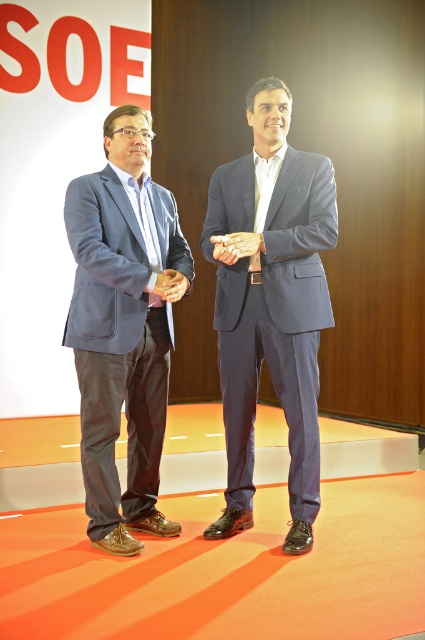
Question: Estimate the real-world distances between objects in this image. Which object is farther from the matte gray suit at center?

Choices:
 (A) matte gray suit at left
 (B) matte brown leather hand at center

Answer: (B)

Question: Which object is positioned farthest from the matte brown leather hand at center?

Choices:
 (A) matte gray suit at center
 (B) matte gray suit at left

Answer: (A)

Question: Which object is positioned closest to the matte gray suit at center?

Choices:
 (A) matte gray suit at left
 (B) matte brown leather hand at center

Answer: (A)

Question: Considering the relative positions of matte gray suit at center and matte brown leather hand at center in the image provided, where is matte gray suit at center located with respect to matte brown leather hand at center?

Choices:
 (A) below
 (B) above

Answer: (A)

Question: Does matte gray suit at center have a lesser width compared to matte gray suit at left?

Choices:
 (A) no
 (B) yes

Answer: (A)

Question: Is matte gray suit at center positioned behind matte brown leather hand at center?

Choices:
 (A) yes
 (B) no

Answer: (A)